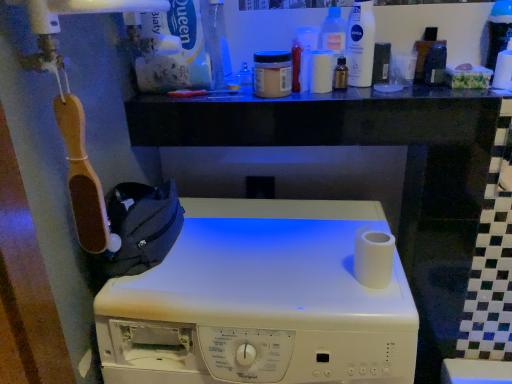
Locate an element on the screen. free point to the right of translucent amber bottle at upper center, the 5th toiletry from the left is located at coordinates (407, 89).